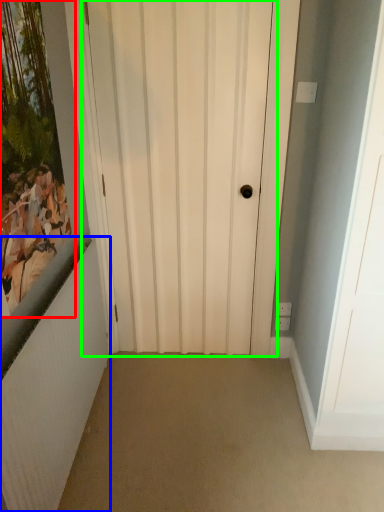
Question: Which object is the closest to the picture frame (highlighted by a red box)? Choose among these: radiator (highlighted by a blue box) or door (highlighted by a green box).

Choices:
 (A) radiator
 (B) door

Answer: (A)